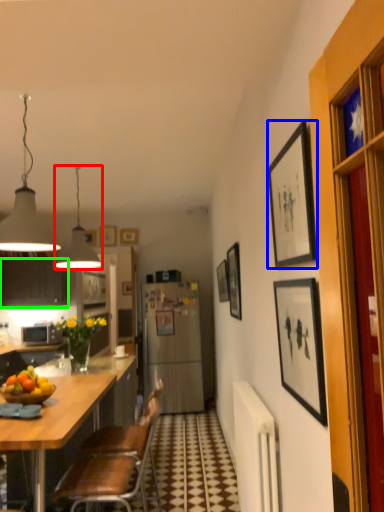
Question: Which object is positioned closest to lamp (highlighted by a red box)? Select from picture frame (highlighted by a blue box) and cabinetry (highlighted by a green box).

Choices:
 (A) picture frame
 (B) cabinetry

Answer: (B)